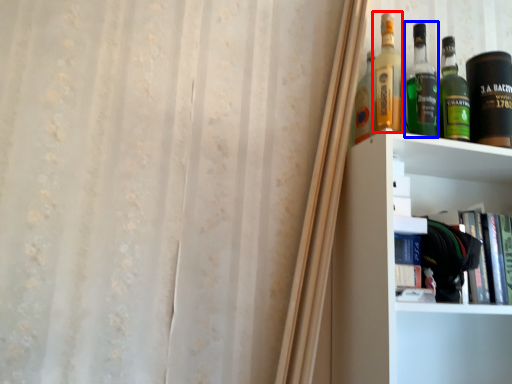
Question: Which point is closer to the camera, bottle (highlighted by a red box) or bottle (highlighted by a blue box)?

Choices:
 (A) bottle
 (B) bottle

Answer: (A)